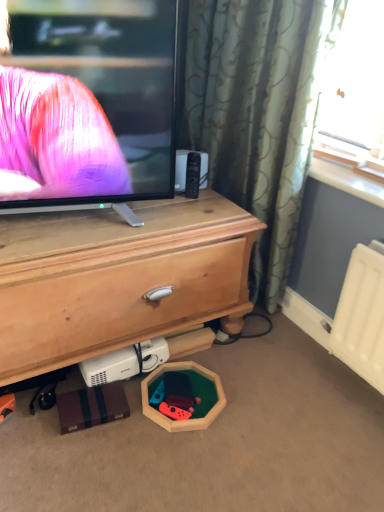
The height and width of the screenshot is (512, 384). Find the location of `wooden chest of drawers at center`. wooden chest of drawers at center is located at coordinates (117, 278).

Describe the element at coordinates (194, 394) in the screenshot. I see `wooden hexagon at lower center, acting as the 1th toy starting from the right` at that location.

Where is `wooden hexagon at lower center, the 1th toy viewed from the left`? wooden hexagon at lower center, the 1th toy viewed from the left is located at coordinates (174, 396).

This screenshot has width=384, height=512. I want to click on the chest of drawers lying above the wooden hexagon at lower center, which ranks as the second toy in left-to-right order (from the image's perspective), so click(x=117, y=278).

In the image, is wooden hexagon at lower center, which ranks as the second toy in left-to-right order, positioned in front of or behind wooden chest of drawers at center?

wooden hexagon at lower center, which ranks as the second toy in left-to-right order, is behind wooden chest of drawers at center.

Considering the relative sizes of wooden hexagon at lower center, which ranks as the second toy in left-to-right order, and wooden chest of drawers at center in the image provided, is wooden hexagon at lower center, which ranks as the second toy in left-to-right order, shorter than wooden chest of drawers at center?

Indeed, wooden hexagon at lower center, which ranks as the second toy in left-to-right order, has a lesser height compared to wooden chest of drawers at center.

Between wooden hexagon at lower center, acting as the 1th toy starting from the right, and wooden chest of drawers at center, which one has smaller width?

Thinner between the two is wooden hexagon at lower center, acting as the 1th toy starting from the right.

Is there a large distance between wooden hexagon at lower center, the 1th toy viewed from the left, and wooden chest of drawers at center?

No, wooden hexagon at lower center, the 1th toy viewed from the left, is in close proximity to wooden chest of drawers at center.

Considering the relative sizes of wooden hexagon at lower center, the 1th toy viewed from the left, and wooden chest of drawers at center in the image provided, is wooden hexagon at lower center, the 1th toy viewed from the left, smaller than wooden chest of drawers at center?

Yes, wooden hexagon at lower center, the 1th toy viewed from the left, is smaller than wooden chest of drawers at center.

Is wooden hexagon at lower center, the second toy when ordered from right to left, facing away from wooden chest of drawers at center?

Yes, wooden hexagon at lower center, the second toy when ordered from right to left, is facing away from wooden chest of drawers at center.

Which is more to the right, wooden hexagon at lower center, the 1th toy viewed from the left, or wooden chest of drawers at center?

Positioned to the right is wooden hexagon at lower center, the 1th toy viewed from the left.

Is wooden chest of drawers at center positioned with its back to wooden hexagon at lower center, which ranks as the second toy in left-to-right order?

wooden chest of drawers at center is not turned away from wooden hexagon at lower center, which ranks as the second toy in left-to-right order.

Is wooden chest of drawers at center bigger or smaller than wooden hexagon at lower center, which ranks as the second toy in left-to-right order?

Clearly, wooden chest of drawers at center is larger in size than wooden hexagon at lower center, which ranks as the second toy in left-to-right order.

Identify the location of the 2nd toy to the right of the wooden chest of drawers at center, starting your count from the anchor. (194, 394).

Who is bigger, wooden chest of drawers at center or wooden hexagon at lower center, the second toy when ordered from right to left?

wooden chest of drawers at center is bigger.

Does point (135, 238) come farther from viewer compared to point (157, 404)?

No, it is in front of (157, 404).

Is wooden hexagon at lower center, the 1th toy viewed from the left, surrounded by wooden chest of drawers at center?

That's incorrect, wooden hexagon at lower center, the 1th toy viewed from the left, is not inside wooden chest of drawers at center.

In the scene shown: Can you confirm if wooden chest of drawers at center is shorter than wooden hexagon at lower center, the second toy when ordered from right to left?

No, wooden chest of drawers at center is not shorter than wooden hexagon at lower center, the second toy when ordered from right to left.

Considering the relative sizes of wooden hexagon at lower center, which ranks as the second toy in left-to-right order, and wooden hexagon at lower center, the second toy when ordered from right to left, in the image provided, is wooden hexagon at lower center, which ranks as the second toy in left-to-right order, taller than wooden hexagon at lower center, the second toy when ordered from right to left,?

Incorrect, the height of wooden hexagon at lower center, which ranks as the second toy in left-to-right order, is not larger of that of wooden hexagon at lower center, the second toy when ordered from right to left.

Would you say wooden hexagon at lower center, which ranks as the second toy in left-to-right order, is to the left or to the right of wooden hexagon at lower center, the second toy when ordered from right to left, in the picture?

Clearly, wooden hexagon at lower center, which ranks as the second toy in left-to-right order, is on the right of wooden hexagon at lower center, the second toy when ordered from right to left, in the image.

From a real-world perspective, is wooden hexagon at lower center, acting as the 1th toy starting from the right, located higher than wooden hexagon at lower center, the second toy when ordered from right to left?

No, from a real-world perspective, wooden hexagon at lower center, acting as the 1th toy starting from the right, is not above wooden hexagon at lower center, the second toy when ordered from right to left.

Is wooden hexagon at lower center, acting as the 1th toy starting from the right, wider or thinner than wooden hexagon at lower center, the 1th toy viewed from the left?

Considering their sizes, wooden hexagon at lower center, acting as the 1th toy starting from the right, looks broader than wooden hexagon at lower center, the 1th toy viewed from the left.

Is wooden hexagon at lower center, the second toy when ordered from right to left, next to wooden hexagon at lower center, which ranks as the second toy in left-to-right order, and touching it?

Yes.

Which is nearer, (185, 389) or (215, 415)?

Point (185, 389).

Based on the photo, which object is thinner, wooden hexagon at lower center, the 1th toy viewed from the left, or wooden hexagon at lower center, which ranks as the second toy in left-to-right order?

wooden hexagon at lower center, the 1th toy viewed from the left.

There is a wooden chest of drawers at center. Identify the location of the 2nd toy below it (from the image's perspective). (194, 394).

At what (x,y) coordinates should I click in order to perform the action: click on chest of drawers to the left of wooden hexagon at lower center, the 1th toy viewed from the left. Please return your answer as a coordinate pair (x, y). Looking at the image, I should click on (117, 278).

Which object lies further to the anchor point wooden hexagon at lower center, the 1th toy viewed from the left, wooden hexagon at lower center, acting as the 1th toy starting from the right, or wooden chest of drawers at center?

The object further to wooden hexagon at lower center, the 1th toy viewed from the left, is wooden chest of drawers at center.

Which object lies further to the anchor point wooden hexagon at lower center, which ranks as the second toy in left-to-right order, wooden hexagon at lower center, the second toy when ordered from right to left, or wooden chest of drawers at center?

wooden chest of drawers at center lies further to wooden hexagon at lower center, which ranks as the second toy in left-to-right order, than the other object.

Considering their positions, is wooden hexagon at lower center, which ranks as the second toy in left-to-right order, positioned further to wooden chest of drawers at center than wooden hexagon at lower center, the second toy when ordered from right to left?

wooden hexagon at lower center, the second toy when ordered from right to left, is positioned further to the anchor wooden chest of drawers at center.

From the image, which object appears to be nearer to wooden hexagon at lower center, the second toy when ordered from right to left, wooden chest of drawers at center or wooden hexagon at lower center, which ranks as the second toy in left-to-right order?

Among the two, wooden hexagon at lower center, which ranks as the second toy in left-to-right order, is located nearer to wooden hexagon at lower center, the second toy when ordered from right to left.

Which object lies further to the anchor point wooden chest of drawers at center, wooden hexagon at lower center, the second toy when ordered from right to left, or wooden hexagon at lower center, acting as the 1th toy starting from the right?

wooden hexagon at lower center, the second toy when ordered from right to left, lies further to wooden chest of drawers at center than the other object.

Estimate the real-world distances between objects in this image. Which object is further from wooden hexagon at lower center, acting as the 1th toy starting from the right, wooden chest of drawers at center or wooden hexagon at lower center, the 1th toy viewed from the left?

Based on the image, wooden chest of drawers at center appears to be further to wooden hexagon at lower center, acting as the 1th toy starting from the right.

Find the location of a particular element. The width and height of the screenshot is (384, 512). toy between wooden chest of drawers at center and wooden hexagon at lower center, which ranks as the second toy in left-to-right order, vertically is located at coordinates (174, 396).